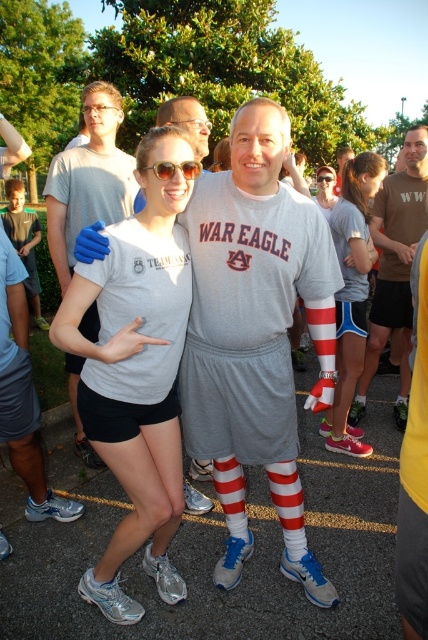
Question: Which object is farther from the camera taking this photo?

Choices:
 (A) matte brown shirt at center
 (B) satin gray t-shirt at center
 (C) matte blue glove at upper left
 (D) matte gray shorts at center

Answer: (A)

Question: Which object appears closest to the camera in this image?

Choices:
 (A) matte blue glove at upper left
 (B) transparent plastic goggles at upper center
 (C) satin gray t-shirt at center

Answer: (C)

Question: Is matte blue glove at upper left closer to camera compared to matte brown shirt at center?

Choices:
 (A) no
 (B) yes

Answer: (B)

Question: Which of these objects is positioned farthest from the sunglasses at center?

Choices:
 (A) transparent plastic goggles at upper center
 (B) matte brown shirt at center
 (C) matte blue glove at upper left
 (D) gray cotton t-shirt at center

Answer: (A)

Question: Considering the relative positions of matte brown shirt at center and matte gray shorts at center in the image provided, where is matte brown shirt at center located with respect to matte gray shorts at center?

Choices:
 (A) above
 (B) below

Answer: (A)

Question: Is sunglasses at center in front of transparent plastic goggles at upper center?

Choices:
 (A) no
 (B) yes

Answer: (B)